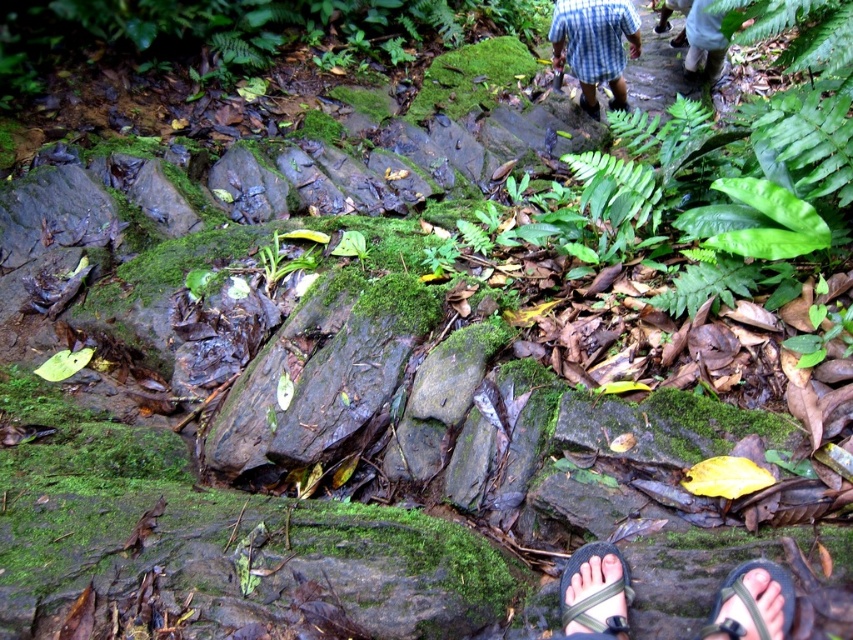
Is point (601, 592) closer to viewer compared to point (780, 570)?

No, it is behind (780, 570).

Who is positioned more to the right, black rubber sandal at lower center or black fabric sandal at lower right?

Positioned to the right is black fabric sandal at lower right.

The height and width of the screenshot is (640, 853). Describe the element at coordinates (595, 592) in the screenshot. I see `black rubber sandal at lower center` at that location.

The height and width of the screenshot is (640, 853). I want to click on black rubber sandal at lower center, so click(595, 592).

What do you see at coordinates (595, 45) in the screenshot? The width and height of the screenshot is (853, 640). I see `blue plaid shirt at upper center` at bounding box center [595, 45].

Who is more distant from viewer, [618,38] or [747,611]?

The point [618,38] is behind.

Who is more distant from viewer, (598, 28) or (705, 632)?

The point (598, 28) is behind.

Find the location of `blue plaid shirt at upper center`. blue plaid shirt at upper center is located at coordinates (595, 45).

Which is in front, point (578, 64) or point (605, 627)?

Positioned in front is point (605, 627).

Image resolution: width=853 pixels, height=640 pixels. What do you see at coordinates (595, 45) in the screenshot?
I see `blue plaid shirt at upper center` at bounding box center [595, 45].

Between point (608, 58) and point (576, 548), which one is positioned behind?

Point (608, 58)

The image size is (853, 640). What are the coordinates of `blue plaid shirt at upper center` in the screenshot? It's located at (595, 45).